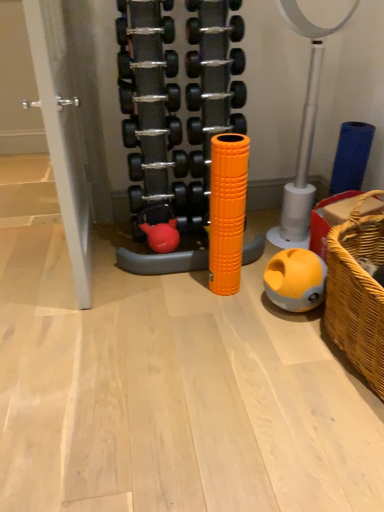
Find the location of `free region on the left part of woven brown basket at lower right`. free region on the left part of woven brown basket at lower right is located at coordinates (261, 369).